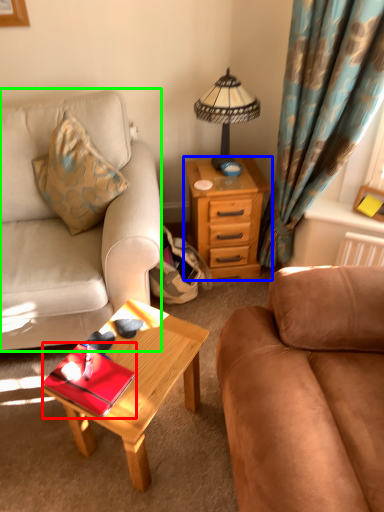
Question: Which object is the farthest from tray (highlighted by a red box)? Choose among these: desk (highlighted by a blue box) or studio couch (highlighted by a green box).

Choices:
 (A) desk
 (B) studio couch

Answer: (A)